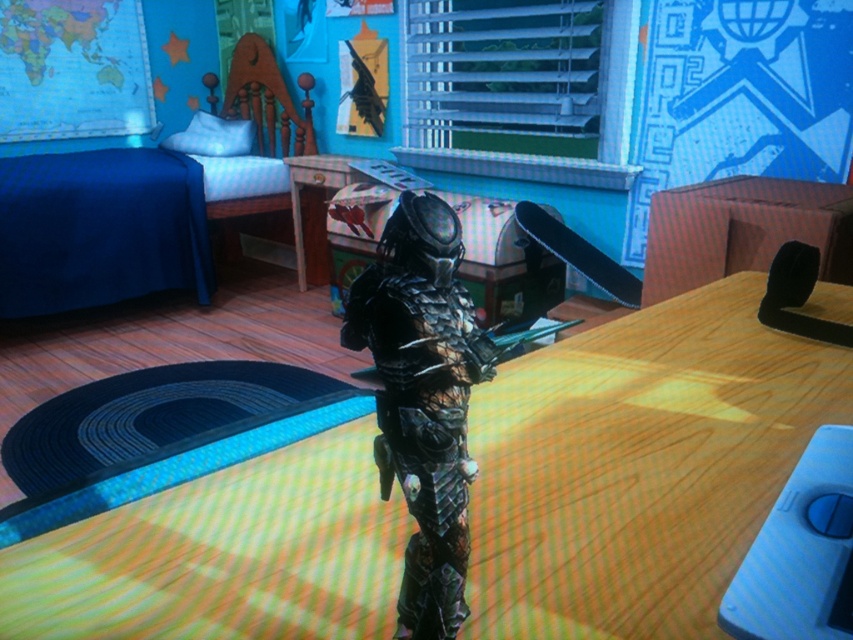
You are a game character who needs to move from the metallic black armor at center to the metallic silver table at center. Which direction should you move to reach the table?

The metallic silver table at center is positioned on the right side of the metallic black armor at center, so you should move to your right to reach the table.